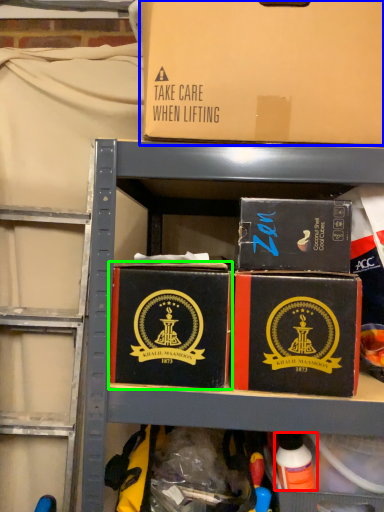
Question: Which object is positioned closest to toy (highlighted by a red box)? Select from box (highlighted by a blue box) and box (highlighted by a green box).

Choices:
 (A) box
 (B) box

Answer: (B)